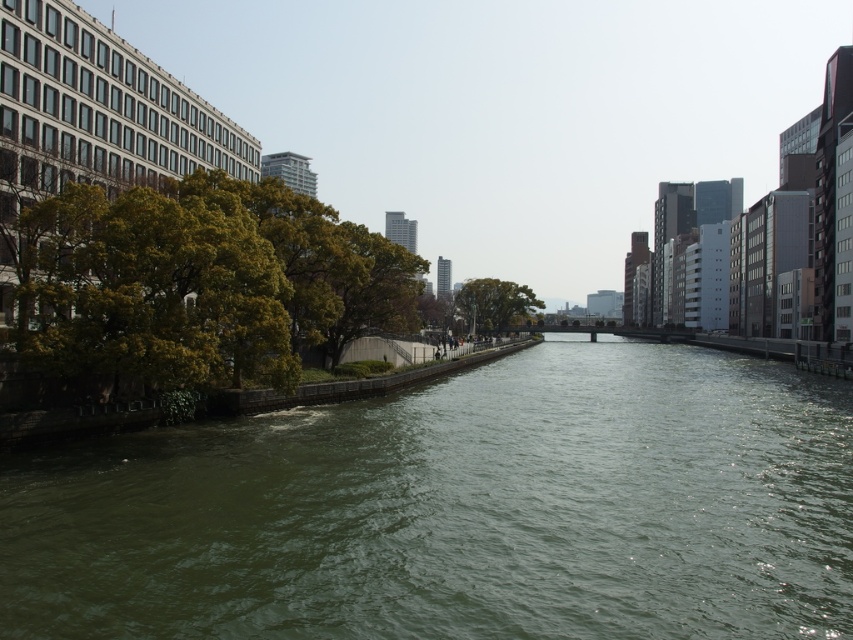
Question: Which point is closer to the camera?

Choices:
 (A) 161,282
 (B) 556,464
 (C) 521,305

Answer: (B)

Question: Is green water at center above green leafy tree at left?

Choices:
 (A) yes
 (B) no

Answer: (B)

Question: Among these points, which one is nearest to the camera?

Choices:
 (A) (207, 220)
 (B) (596, 456)

Answer: (B)

Question: Is green water at center thinner than green leafy tree at left?

Choices:
 (A) yes
 (B) no

Answer: (B)

Question: Is green leafy tree at left thinner than green leafy tree at center?

Choices:
 (A) yes
 (B) no

Answer: (B)

Question: Considering the real-world distances, which object is farthest from the green water at center?

Choices:
 (A) green leafy tree at center
 (B) green leafy tree at left

Answer: (A)